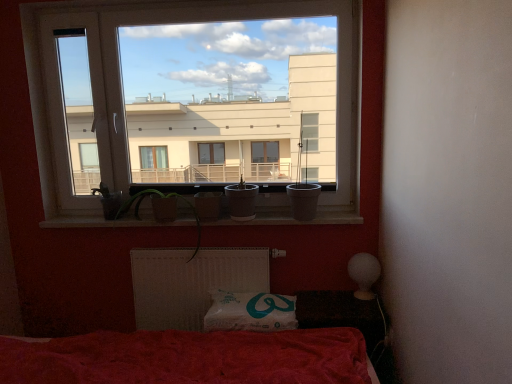
The width and height of the screenshot is (512, 384). I want to click on vacant location below matte white pot at center (from a real-world perspective), so click(x=243, y=217).